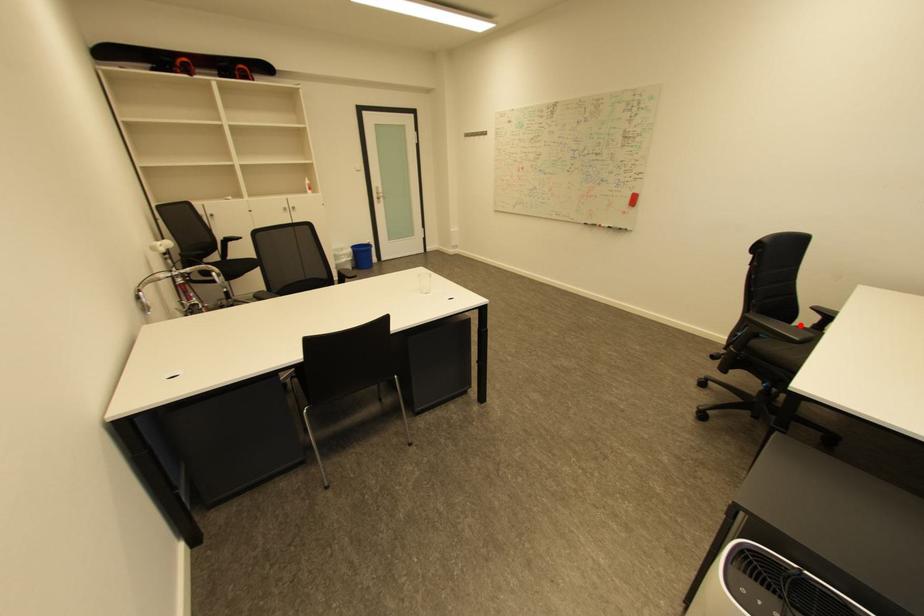
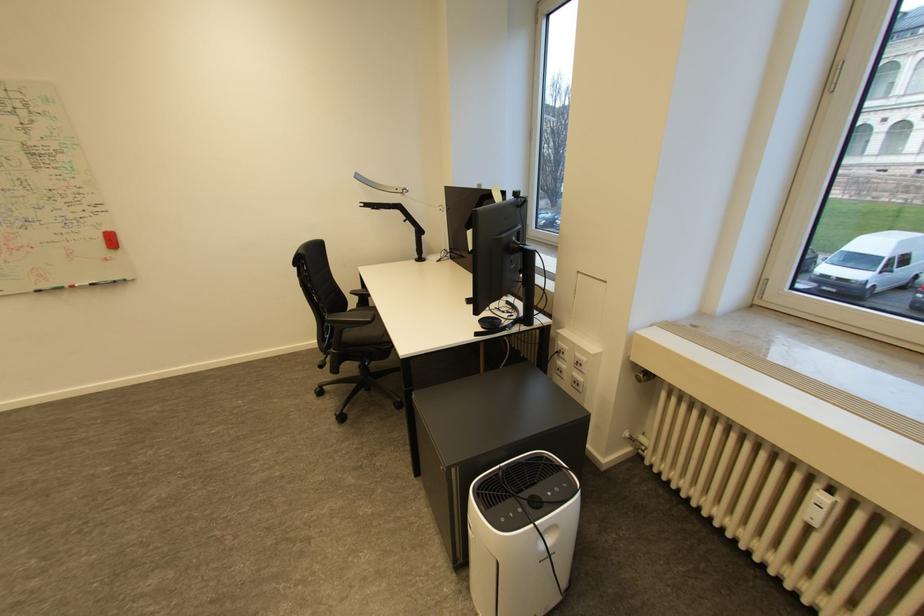
Question: I am providing you with two images of the same scene from different viewpoints. In image1, a red point is highlighted. Considering the same 3D point in image2, which of the following is correct?

Choices:
 (A) It is closer
 (B) It is farther

Answer: (A)